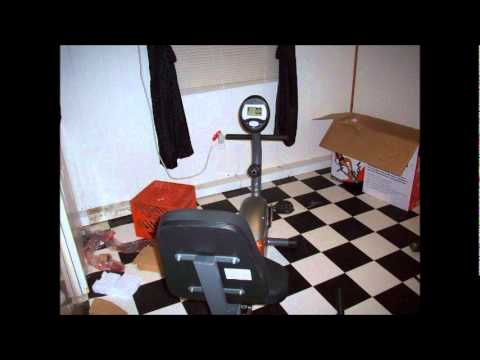
At what (x,y) coordinates should I click in order to perform the action: click on backrest. Please return your answer as a coordinate pair (x, y). Looking at the image, I should click on (208, 241).